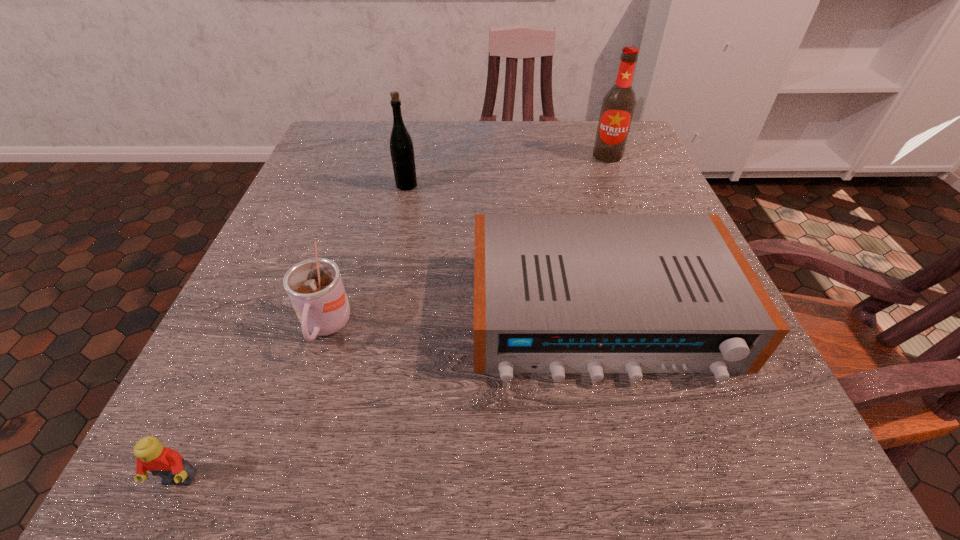
The height and width of the screenshot is (540, 960). I want to click on the right beer bottle, so click(618, 105).

Find the location of `the farther beer bottle`. the farther beer bottle is located at coordinates (618, 105).

Locate an element on the screen. The image size is (960, 540). the second farthest object is located at coordinates (401, 146).

You are a GUI agent. You are given a task and a screenshot of the screen. Output one action in this format:
    pyautogui.click(x=<x>, y=<y>)
    Task: Click on the third object from left to right
    This screenshot has width=960, height=540.
    Given the screenshot: What is the action you would take?
    pyautogui.click(x=401, y=146)

At what (x,y) coordinates should I click in order to perform the action: click on cup. Please return your answer as a coordinate pair (x, y). This screenshot has height=540, width=960. Looking at the image, I should click on (314, 286).

You are a GUI agent. You are given a task and a screenshot of the screen. Output one action in this format:
    pyautogui.click(x=<x>, y=<y>)
    Task: Click on the third shortest object
    The image size is (960, 540).
    Given the screenshot: What is the action you would take?
    tap(314, 286)

You are a GUI agent. You are given a task and a screenshot of the screen. Output one action in this format:
    pyautogui.click(x=<x>, y=<y>)
    Task: Click on the radio receiver
    Image resolution: width=960 pixels, height=540 pixels.
    Given the screenshot: What is the action you would take?
    pyautogui.click(x=553, y=293)

You are a GUI agent. You are given a task and a screenshot of the screen. Output one action in this format:
    pyautogui.click(x=<x>, y=<y>)
    Task: Click on the leftmost object
    The height and width of the screenshot is (540, 960).
    Given the screenshot: What is the action you would take?
    pyautogui.click(x=150, y=454)

You are a GUI agent. You are given a task and a screenshot of the screen. Output one action in this format:
    pyautogui.click(x=<x>, y=<y>)
    Task: Click on the nearest object
    The image size is (960, 540).
    Given the screenshot: What is the action you would take?
    pyautogui.click(x=150, y=454)

Find the location of a particular element. vacant space situated 0.050m on the back of the right beer bottle is located at coordinates click(601, 139).